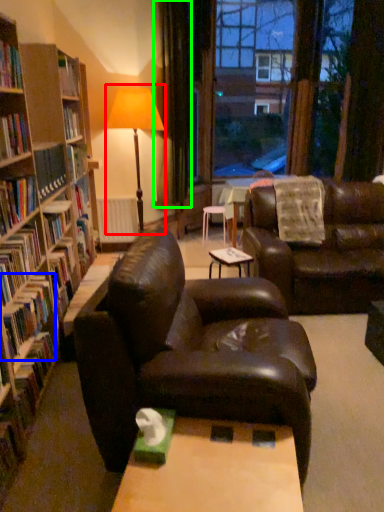
Question: Considering the real-world distances, which object is closest to table lamp (highlighted by a red box)? book (highlighted by a blue box) or curtain (highlighted by a green box).

Choices:
 (A) book
 (B) curtain

Answer: (B)